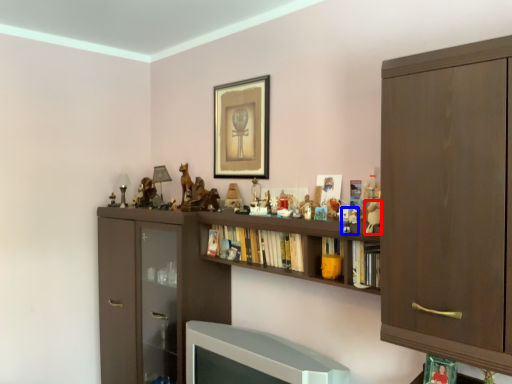
Question: Which object appears farthest to the camera in this image, toy (highlighted by a red box) or toy (highlighted by a blue box)?

Choices:
 (A) toy
 (B) toy

Answer: (B)